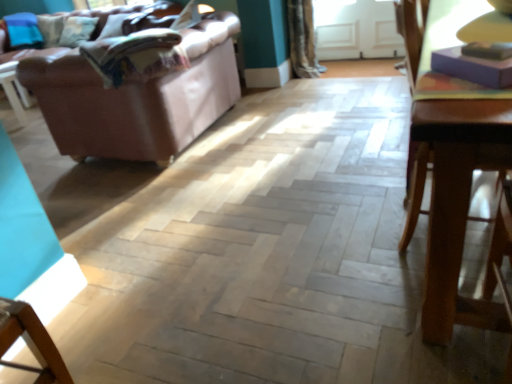
Question: Is transparent glass door at upper center not near textured beige curtain at upper center?

Choices:
 (A) no
 (B) yes

Answer: (A)

Question: Can you confirm if transparent glass door at upper center is wider than textured beige curtain at upper center?

Choices:
 (A) yes
 (B) no

Answer: (B)

Question: Considering the relative positions of transparent glass door at upper center and textured beige curtain at upper center in the image provided, is transparent glass door at upper center to the right of textured beige curtain at upper center from the viewer's perspective?

Choices:
 (A) yes
 (B) no

Answer: (A)

Question: Is transparent glass door at upper center smaller than textured beige curtain at upper center?

Choices:
 (A) yes
 (B) no

Answer: (A)

Question: Is transparent glass door at upper center oriented towards textured beige curtain at upper center?

Choices:
 (A) yes
 (B) no

Answer: (A)

Question: In the image, is transparent glass door at upper center on the left side or the right side of textured beige curtain at upper center?

Choices:
 (A) right
 (B) left

Answer: (A)

Question: Is transparent glass door at upper center bigger or smaller than textured beige curtain at upper center?

Choices:
 (A) big
 (B) small

Answer: (B)

Question: Considering the positions of point (365, 9) and point (302, 34), is point (365, 9) closer or farther from the camera than point (302, 34)?

Choices:
 (A) closer
 (B) farther

Answer: (B)

Question: From the image's perspective, is transparent glass door at upper center located above or below textured beige curtain at upper center?

Choices:
 (A) below
 (B) above

Answer: (B)

Question: Looking at their shapes, would you say wooden table at right is wider or thinner than textured beige curtain at upper center?

Choices:
 (A) thin
 (B) wide

Answer: (B)

Question: From the image's perspective, is wooden table at right above or below textured beige curtain at upper center?

Choices:
 (A) above
 (B) below

Answer: (B)

Question: Is point (428, 38) closer or farther from the camera than point (313, 54)?

Choices:
 (A) closer
 (B) farther

Answer: (A)

Question: Is wooden table at right taller or shorter than textured beige curtain at upper center?

Choices:
 (A) short
 (B) tall

Answer: (B)

Question: Considering the relative positions of textured beige curtain at upper center and purple matte book at upper right in the image provided, is textured beige curtain at upper center to the left or to the right of purple matte book at upper right?

Choices:
 (A) left
 (B) right

Answer: (A)

Question: In the image, is textured beige curtain at upper center positioned in front of or behind purple matte book at upper right?

Choices:
 (A) behind
 (B) front

Answer: (A)